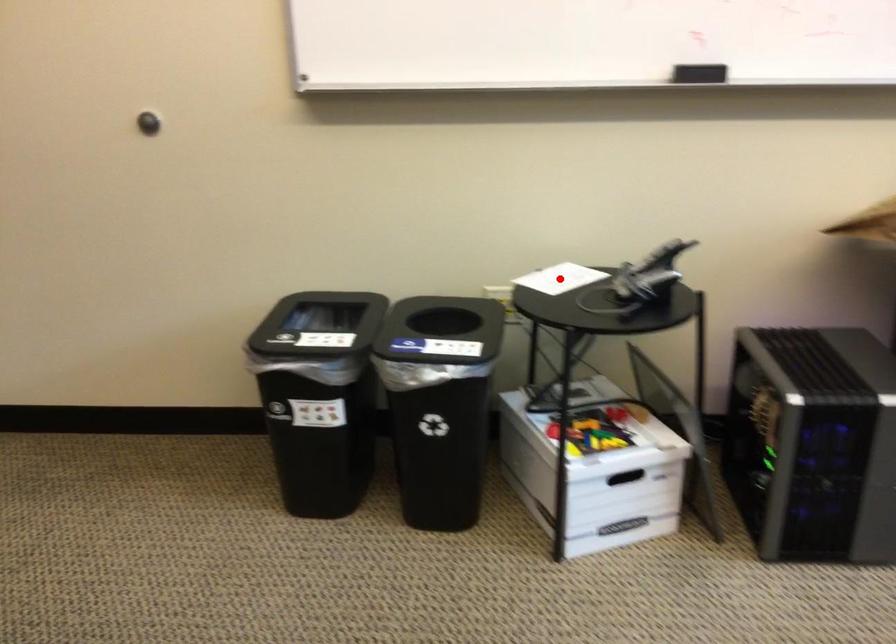
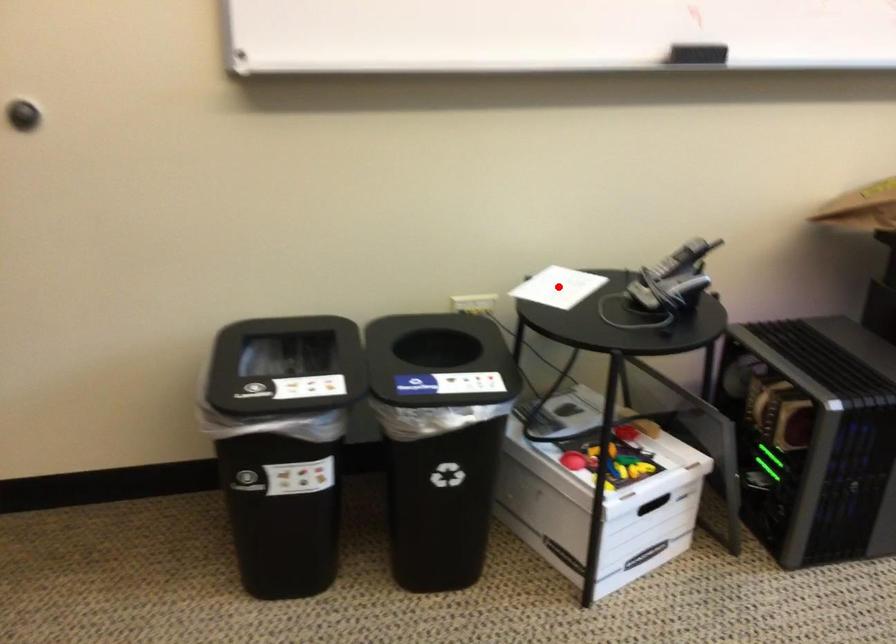
I am providing you with two images of the same scene from different viewpoints. A red point is marked on the first image and another point is marked on the second image. Are the points marked in image1 and image2 representing the same 3D position?

Yes